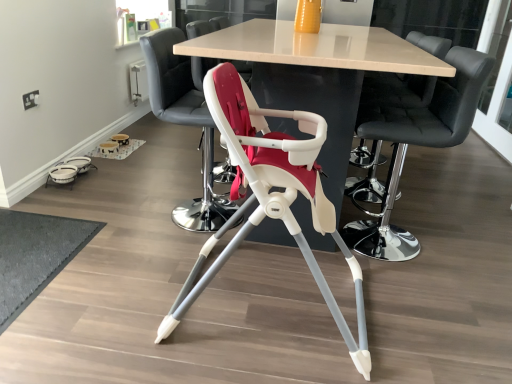
You are a GUI agent. You are given a task and a screenshot of the screen. Output one action in this format:
    pyautogui.click(x=<x>, y=<y>)
    Task: Click on the vacant region in front of smooth black bar stool at center, placed as the first chair when sorted from right to left
    
    Given the screenshot: What is the action you would take?
    pyautogui.click(x=399, y=212)